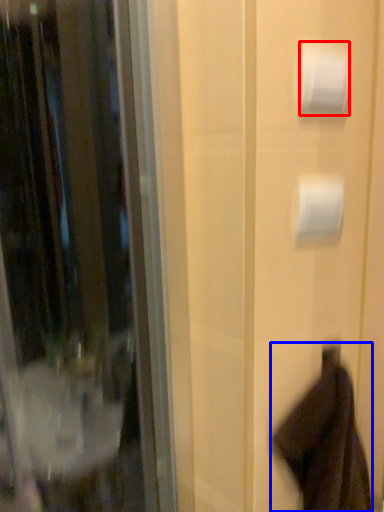
Question: Which object is closer to the camera taking this photo, toilet paper (highlighted by a red box) or robe (highlighted by a blue box)?

Choices:
 (A) toilet paper
 (B) robe

Answer: (B)